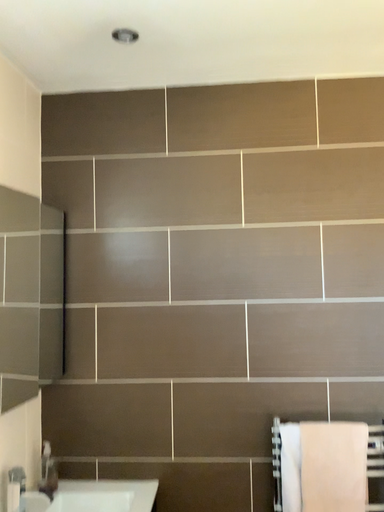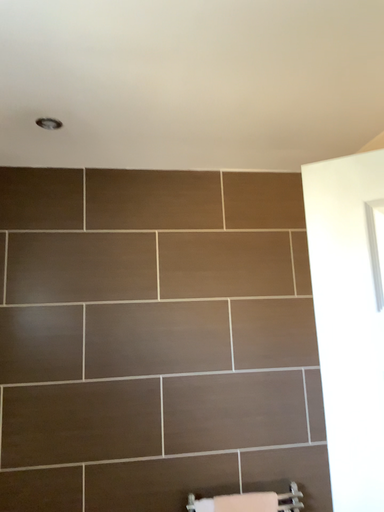
Question: How did the camera likely rotate when shooting the video?

Choices:
 (A) rotated right
 (B) rotated left

Answer: (A)